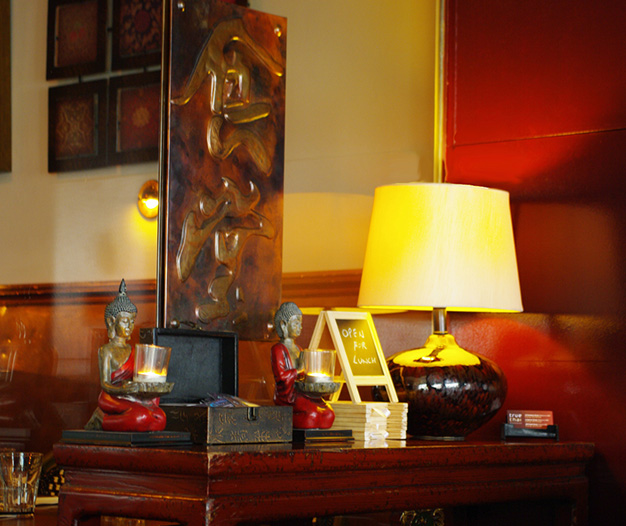
This screenshot has height=526, width=626. What are the coordinates of `statue` in the screenshot? It's located at (126, 402), (292, 384).